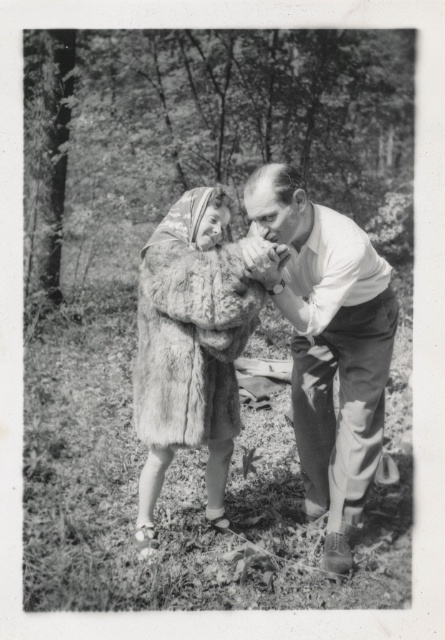
Does smooth white shirt at center appear over fuzzy fur coat at center?

Indeed, smooth white shirt at center is positioned over fuzzy fur coat at center.

Between smooth white shirt at center and fuzzy fur coat at center, which one is positioned lower?

fuzzy fur coat at center is below.

Is point (299, 253) less distant than point (183, 358)?

No.

The width and height of the screenshot is (445, 640). Identify the location of smooth white shirt at center. (327, 346).